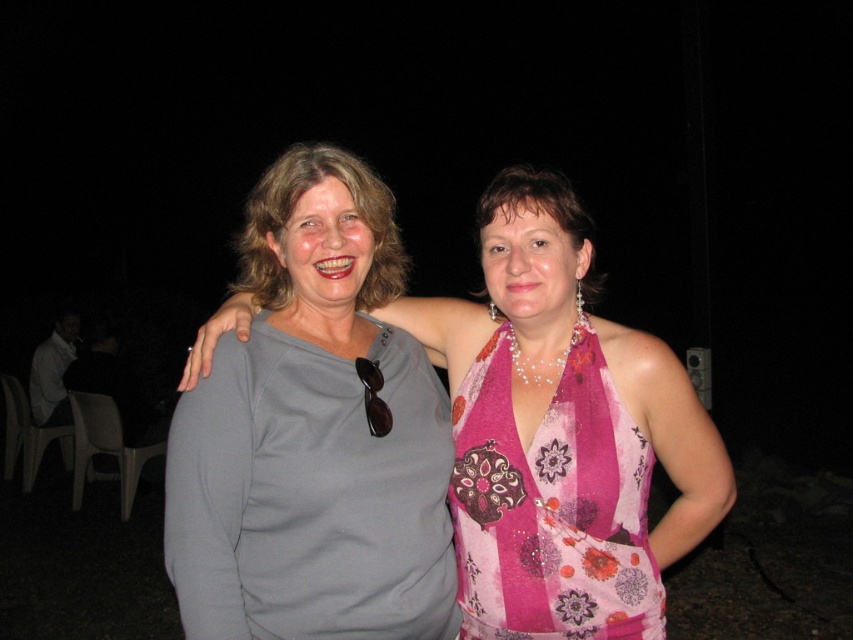
Question: Which point appears farthest from the camera in this image?

Choices:
 (A) (717, 515)
 (B) (311, 611)

Answer: (A)

Question: Can you confirm if matte gray shirt at center is positioned above gray fabric shirt at center?

Choices:
 (A) yes
 (B) no

Answer: (A)

Question: Is matte gray shirt at center closer to camera compared to gray fabric shirt at center?

Choices:
 (A) yes
 (B) no

Answer: (A)

Question: Which of the following is the closest to the observer?

Choices:
 (A) matte gray shirt at center
 (B) gray fabric shirt at center
 (C) pink floral fabric dress at center

Answer: (A)

Question: Considering the relative positions of matte gray shirt at center and gray fabric shirt at center in the image provided, where is matte gray shirt at center located with respect to gray fabric shirt at center?

Choices:
 (A) left
 (B) right

Answer: (A)

Question: Which of the following is the closest to the observer?

Choices:
 (A) (492, 317)
 (B) (598, 417)

Answer: (B)